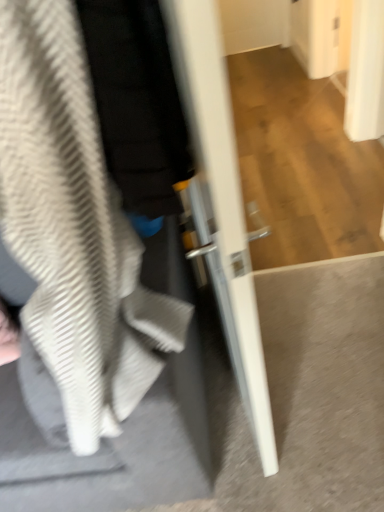
Question: Considering their positions, is white glossy door at center located in front of or behind textured gray sweatshirt at left?

Choices:
 (A) front
 (B) behind

Answer: (A)

Question: Considering the positions of white glossy door at center and textured gray sweatshirt at left in the image, is white glossy door at center bigger or smaller than textured gray sweatshirt at left?

Choices:
 (A) big
 (B) small

Answer: (B)

Question: In terms of height, does white glossy door at center look taller or shorter compared to textured gray sweatshirt at left?

Choices:
 (A) short
 (B) tall

Answer: (B)

Question: Is textured gray sweatshirt at left in front of or behind white glossy door at center in the image?

Choices:
 (A) front
 (B) behind

Answer: (B)

Question: From a real-world perspective, is textured gray sweatshirt at left above or below white glossy door at center?

Choices:
 (A) above
 (B) below

Answer: (B)

Question: From the image's perspective, is textured gray sweatshirt at left located above or below white glossy door at center?

Choices:
 (A) above
 (B) below

Answer: (B)

Question: Is textured gray sweatshirt at left wider or thinner than white glossy door at center?

Choices:
 (A) wide
 (B) thin

Answer: (A)